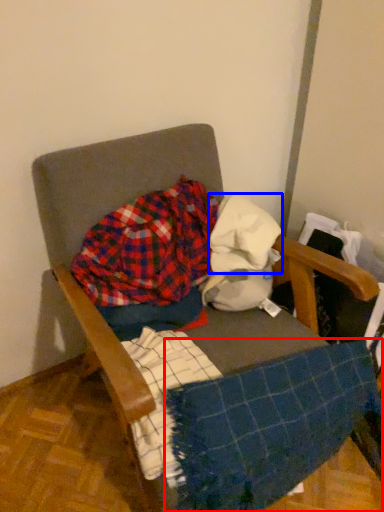
Question: Which object is further to the camera taking this photo, blanket (highlighted by a red box) or fabric (highlighted by a blue box)?

Choices:
 (A) blanket
 (B) fabric

Answer: (B)